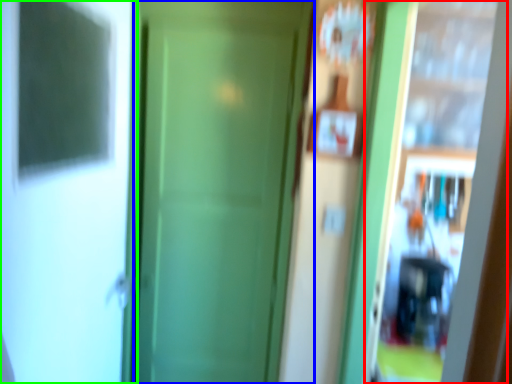
Question: Based on their relative distances, which object is farther from screen door (highlighted by a red box)? Choose from door (highlighted by a blue box) and screen door (highlighted by a green box).

Choices:
 (A) door
 (B) screen door

Answer: (B)